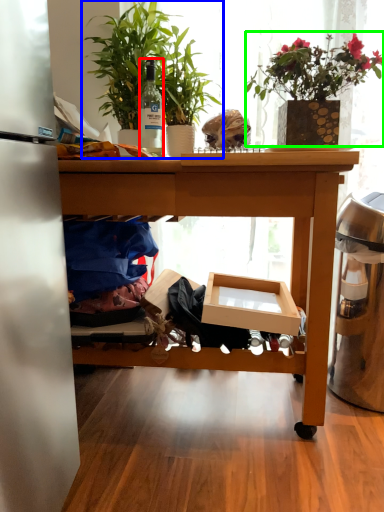
Question: Considering the real-world distances, which object is closest to bottle (highlighted by a red box)? houseplant (highlighted by a blue box) or houseplant (highlighted by a green box).

Choices:
 (A) houseplant
 (B) houseplant

Answer: (A)